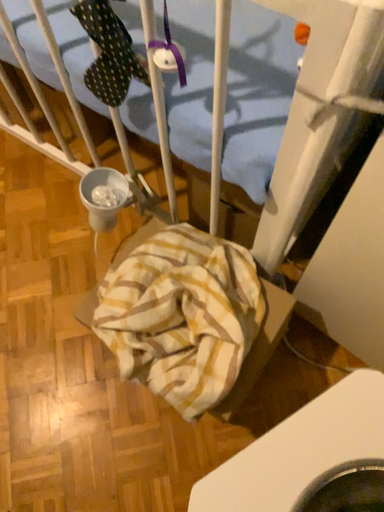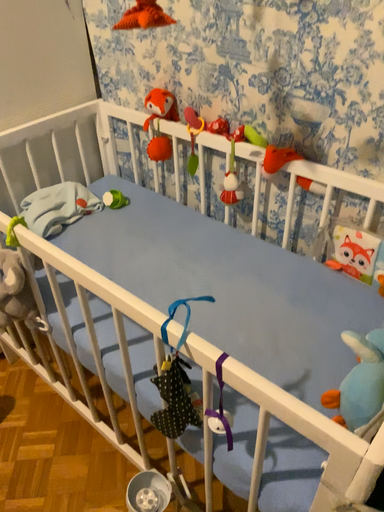
Question: How did the camera likely rotate when shooting the video?

Choices:
 (A) rotated upward
 (B) rotated downward

Answer: (A)